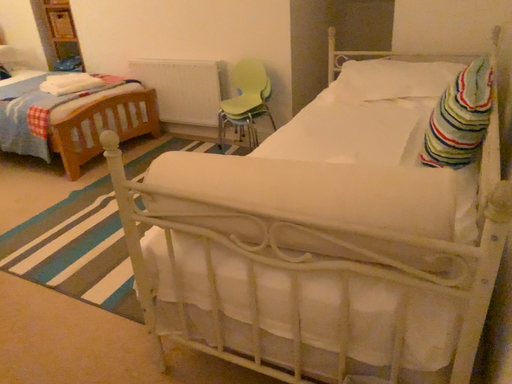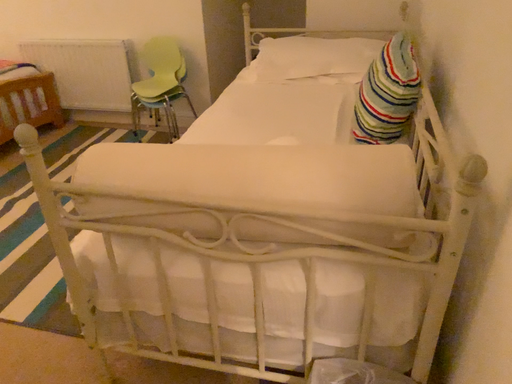
Question: Which way did the camera rotate in the video?

Choices:
 (A) rotated right
 (B) rotated left

Answer: (A)